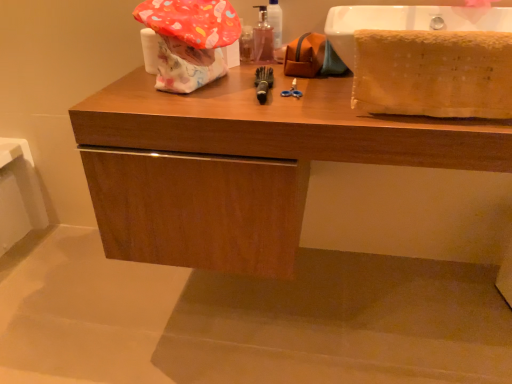
Question: Could you tell me if soft yellow towel at right is facing black rubber toothbrush at center?

Choices:
 (A) yes
 (B) no

Answer: (B)

Question: Is soft yellow towel at right closer to the viewer compared to black rubber toothbrush at center?

Choices:
 (A) yes
 (B) no

Answer: (A)

Question: Does soft yellow towel at right have a lesser width compared to black rubber toothbrush at center?

Choices:
 (A) yes
 (B) no

Answer: (A)

Question: From a real-world perspective, is soft yellow towel at right beneath black rubber toothbrush at center?

Choices:
 (A) no
 (B) yes

Answer: (A)

Question: Can you confirm if soft yellow towel at right is shorter than black rubber toothbrush at center?

Choices:
 (A) no
 (B) yes

Answer: (A)

Question: Is black rubber toothbrush at center taller or shorter than soft yellow towel at right?

Choices:
 (A) tall
 (B) short

Answer: (B)

Question: In the image, is black rubber toothbrush at center on the left side or the right side of soft yellow towel at right?

Choices:
 (A) right
 (B) left

Answer: (B)

Question: Is black rubber toothbrush at center wider or thinner than soft yellow towel at right?

Choices:
 (A) wide
 (B) thin

Answer: (A)

Question: Is black rubber toothbrush at center bigger or smaller than soft yellow towel at right?

Choices:
 (A) big
 (B) small

Answer: (B)

Question: In terms of height, does soft yellow towel at right look taller or shorter compared to wooden cabinet at center?

Choices:
 (A) tall
 (B) short

Answer: (B)

Question: Choose the correct answer: Is soft yellow towel at right inside wooden cabinet at center or outside it?

Choices:
 (A) inside
 (B) outside

Answer: (B)

Question: Looking at the image, does soft yellow towel at right seem bigger or smaller compared to wooden cabinet at center?

Choices:
 (A) small
 (B) big

Answer: (A)

Question: Considering the relative positions of soft yellow towel at right and wooden cabinet at center in the image provided, is soft yellow towel at right to the left or to the right of wooden cabinet at center?

Choices:
 (A) left
 (B) right

Answer: (B)

Question: Is translucent plastic mouthwash at center in front of or behind wooden cabinet at center in the image?

Choices:
 (A) front
 (B) behind

Answer: (B)

Question: Is translucent plastic mouthwash at center taller or shorter than wooden cabinet at center?

Choices:
 (A) short
 (B) tall

Answer: (A)